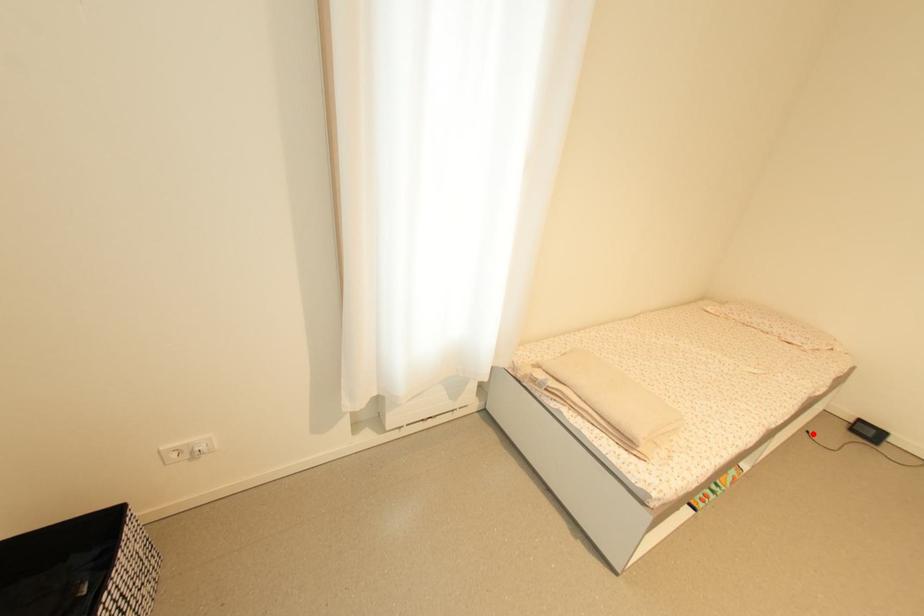
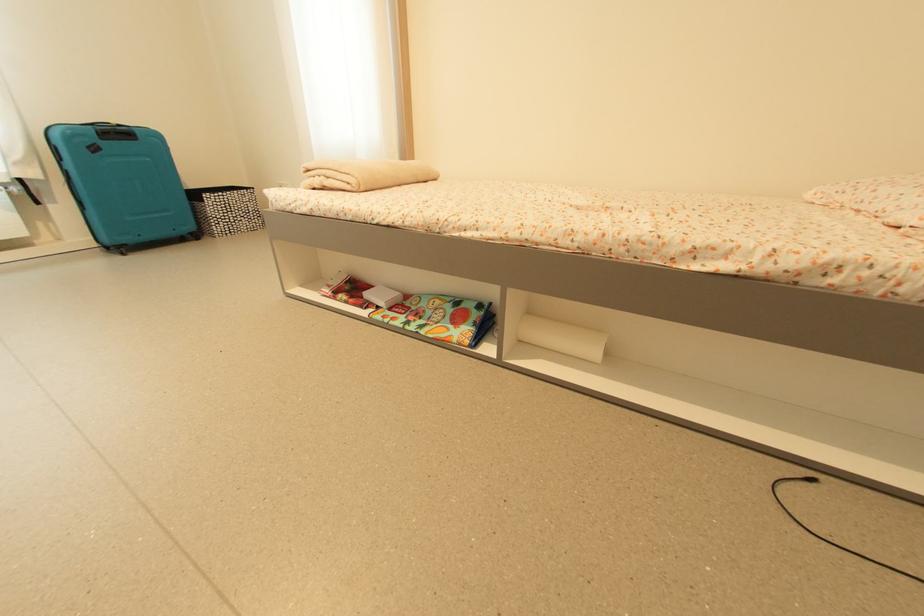
In the second image, find the point that corresponds to the highlighted location in the first image.

(817, 483)